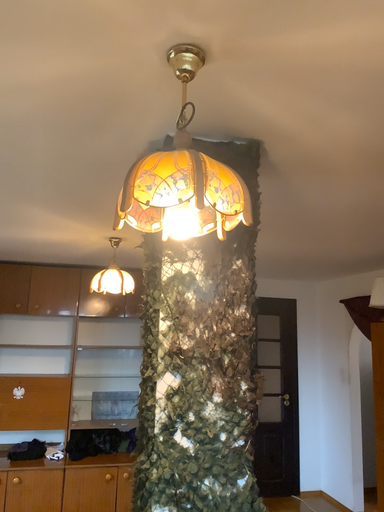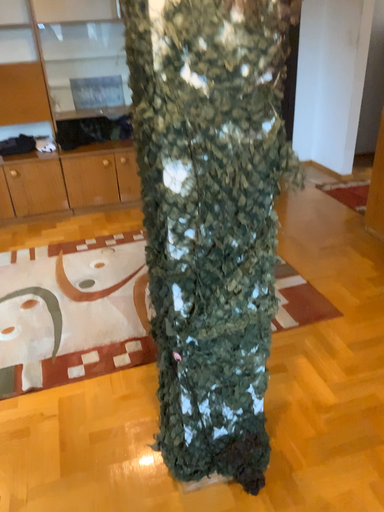
Question: How did the camera likely rotate when shooting the video?

Choices:
 (A) rotated downward
 (B) rotated upward

Answer: (A)